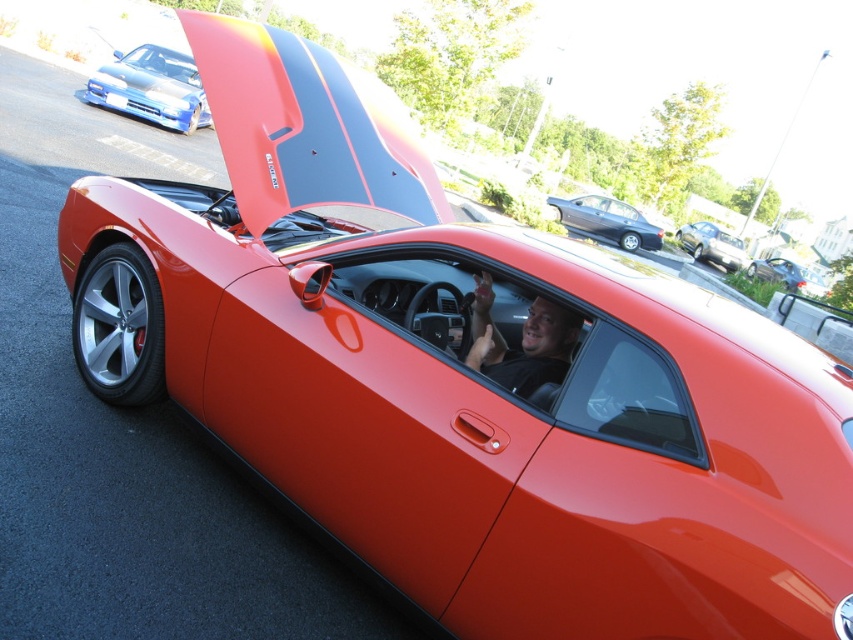
Question: Can you confirm if shiny metallic hood at upper center is positioned above satin black sedan at center?

Choices:
 (A) no
 (B) yes

Answer: (A)

Question: Does shiny metallic hood at upper center have a lesser width compared to satin black sedan at center?

Choices:
 (A) yes
 (B) no

Answer: (A)

Question: Which point is farther to the camera?

Choices:
 (A) blue glossy sports car at upper left
 (B) satin black sedan at center
 (C) metallic gray sedan at center

Answer: (B)

Question: Where is satin black sedan at center located in relation to glossy metallic car at center in the image?

Choices:
 (A) above
 (B) below

Answer: (A)

Question: Which of these objects is positioned closest to the satin black sedan at center?

Choices:
 (A) shiny metallic hood at upper center
 (B) blue glossy sports car at upper left
 (C) metallic gray sedan at center
 (D) glossy metallic car at center

Answer: (D)

Question: Estimate the real-world distances between objects in this image. Which object is farther from the shiny metallic hood at upper center?

Choices:
 (A) blue glossy sports car at upper left
 (B) metallic gray sedan at center
 (C) glossy metallic car at center
 (D) satin black sedan at center

Answer: (D)